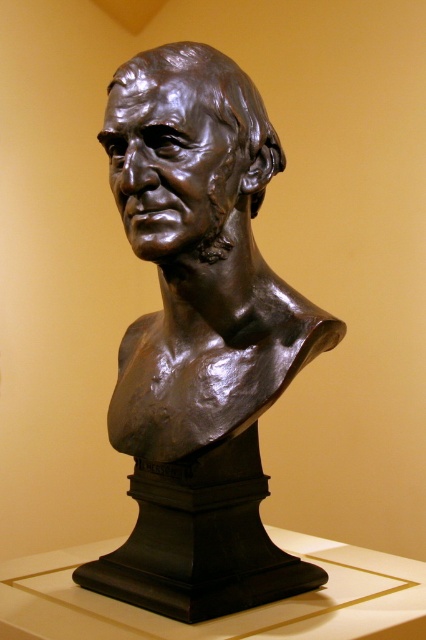
Question: From the image, what is the correct spatial relationship of matte bronze bust at center in relation to bronze bust at center?

Choices:
 (A) above
 (B) below

Answer: (B)

Question: Can you confirm if matte bronze bust at center is positioned above bronze bust at center?

Choices:
 (A) no
 (B) yes

Answer: (A)

Question: Which point is closer to the camera taking this photo?

Choices:
 (A) (233, 145)
 (B) (198, 422)

Answer: (A)

Question: Is matte bronze bust at center thinner than bronze bust at center?

Choices:
 (A) yes
 (B) no

Answer: (B)